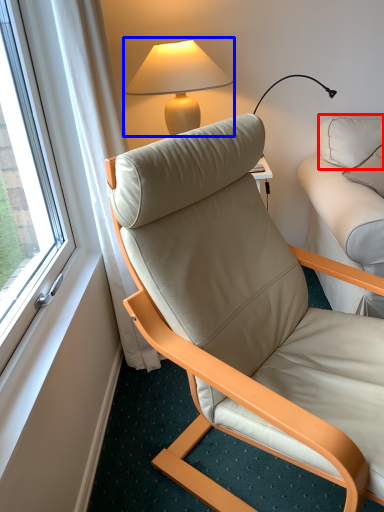
Question: Among these objects, which one is nearest to the camera, pillow (highlighted by a red box) or lamp (highlighted by a blue box)?

Choices:
 (A) pillow
 (B) lamp

Answer: (A)